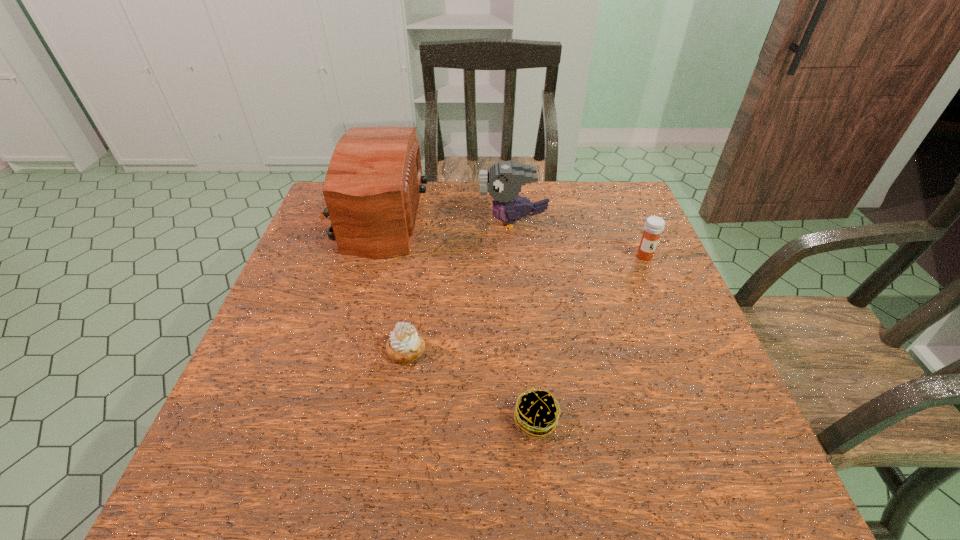
This screenshot has height=540, width=960. Find the location of `vacant space that satisfies the following two spatial constraints: 1. on the front-facing side of the nearest object; 2. on the right side of the radio receiver`. vacant space that satisfies the following two spatial constraints: 1. on the front-facing side of the nearest object; 2. on the right side of the radio receiver is located at coordinates (311, 420).